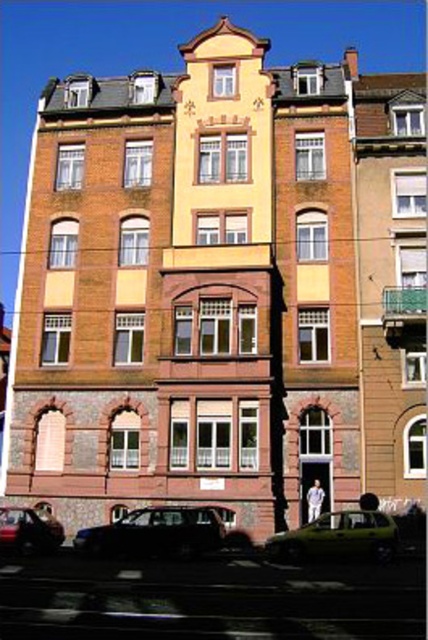
Question: Based on their relative distances, which object is farther from the shiny black car at lower left?

Choices:
 (A) green matte car at center
 (B) shiny black car at lower center

Answer: (A)

Question: Does green matte car at center come behind shiny black car at lower left?

Choices:
 (A) yes
 (B) no

Answer: (B)

Question: Which object is positioned farthest from the shiny black car at lower center?

Choices:
 (A) green matte car at center
 (B) shiny black car at lower left

Answer: (A)

Question: Can you confirm if shiny black car at lower center is positioned to the left of green matte car at center?

Choices:
 (A) no
 (B) yes

Answer: (B)

Question: From the image, what is the correct spatial relationship of shiny black car at lower center in relation to green matte car at center?

Choices:
 (A) left
 (B) right

Answer: (A)

Question: Which object appears farthest from the camera in this image?

Choices:
 (A) shiny black car at lower left
 (B) shiny black car at lower center

Answer: (A)